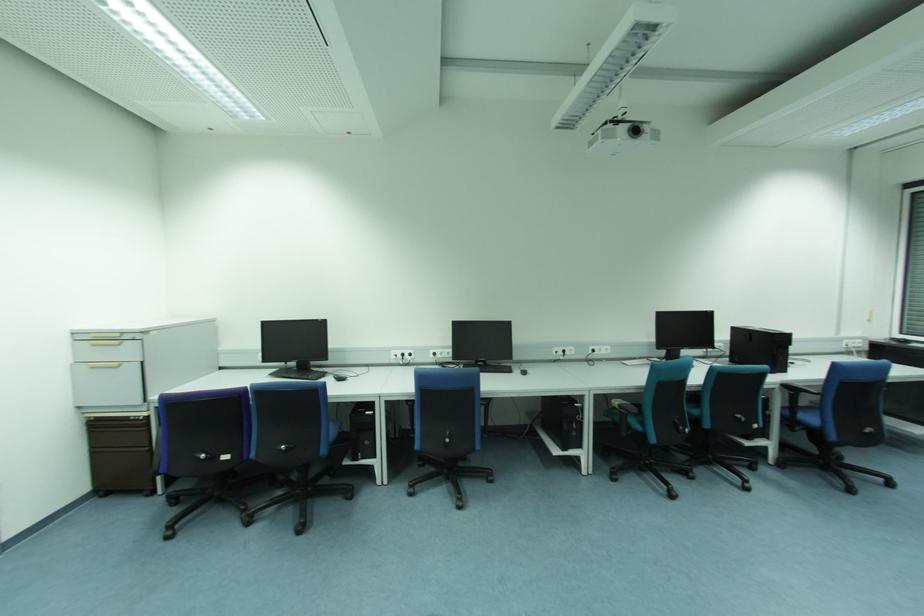
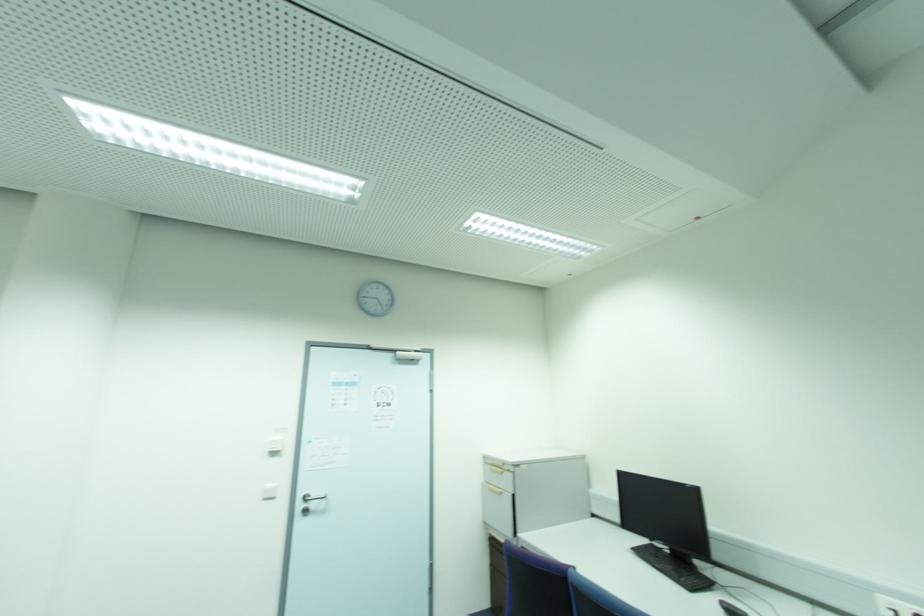
Question: I am providing you with two images of the same scene from different viewpoints. Which of the following objects are not visible in image2?

Choices:
 (A) silver door handle
 (B) white light switch
 (C) cabinet drawer handle
 (D) none of these

Answer: (D)